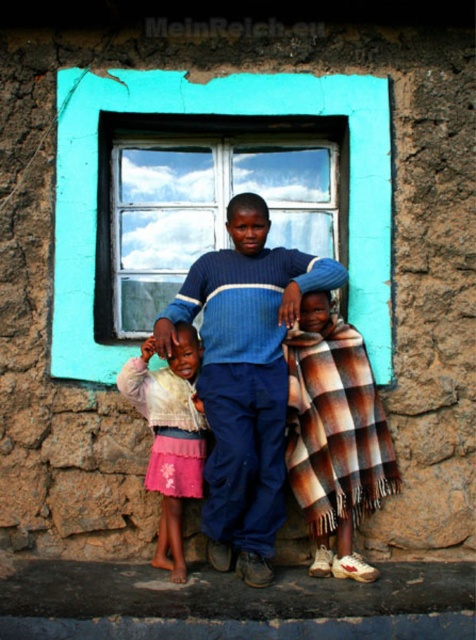
You are a photographer trying to capture the children against the rustic stone wall backdrop. The teal glass window at center and the plaid woolen blanket at center are both in the frame. Which object is positioned higher in the image?

The teal glass window at center is positioned higher than the plaid woolen blanket at center in the image.

You are a delivery robot with a package that measures 4 feet in length. You need to move through the space between the teal glass window at center and the plaid woolen blanket at center. Can your package fit through this space?

The distance between the teal glass window at center and the plaid woolen blanket at center is 3.94 feet, which is slightly less than the 4 feet length of the package. Therefore, the package cannot fit through this space.